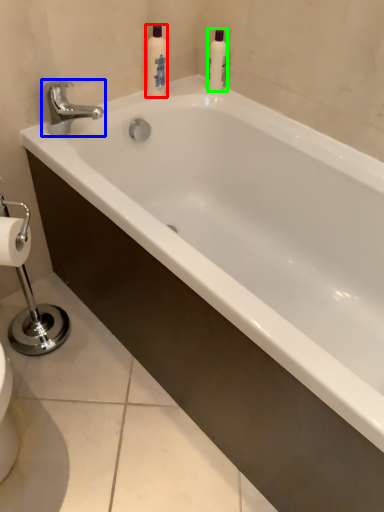
Question: Based on their relative distances, which object is farther from cleaning product (highlighted by a red box)? Choose from tap (highlighted by a blue box) and cleaning product (highlighted by a green box).

Choices:
 (A) tap
 (B) cleaning product

Answer: (A)